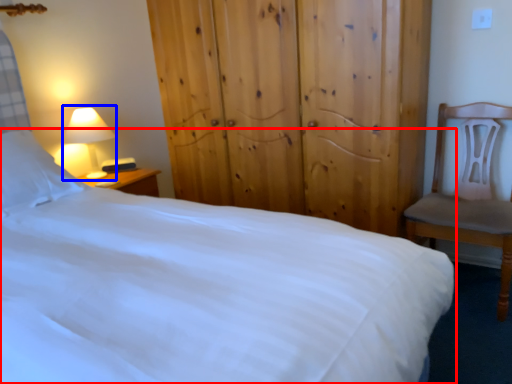
Question: Among these objects, which one is nearest to the camera, bed (highlighted by a red box) or lamp (highlighted by a blue box)?

Choices:
 (A) bed
 (B) lamp

Answer: (A)